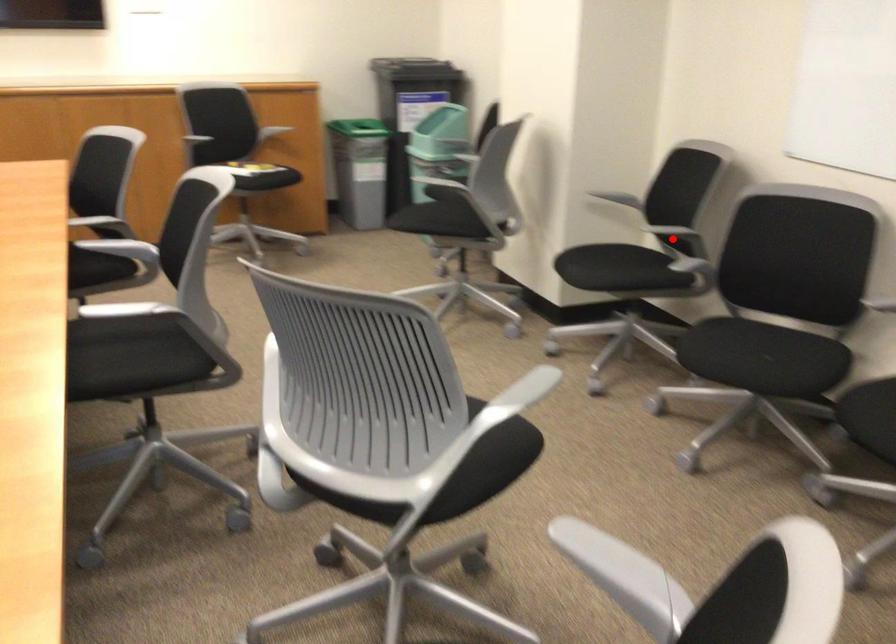
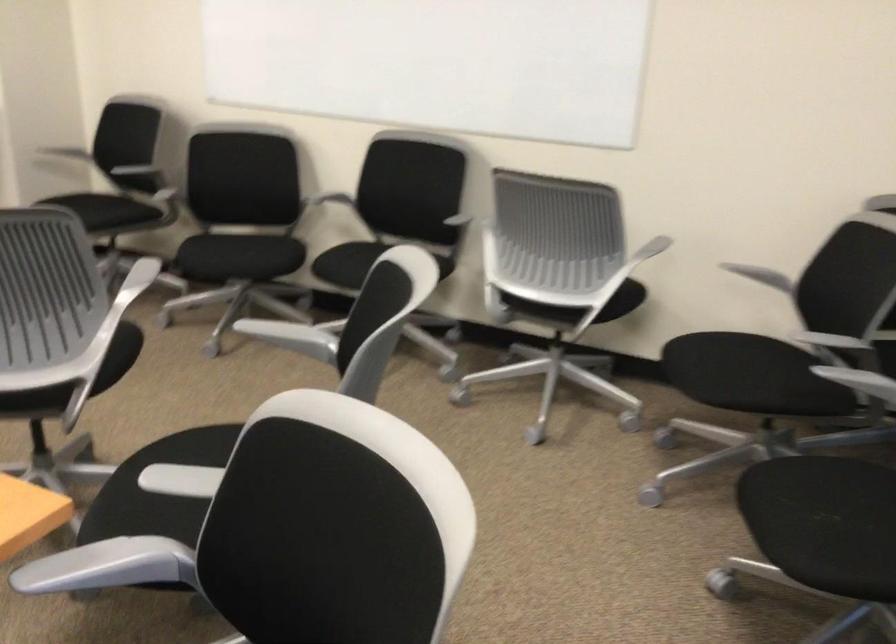
Question: I am providing you with two images of the same scene from different viewpoints. Given a red point in image1, look at the same physical point in image2. Is it:

Choices:
 (A) Closer to the viewpoint
 (B) Farther from the viewpoint

Answer: (B)